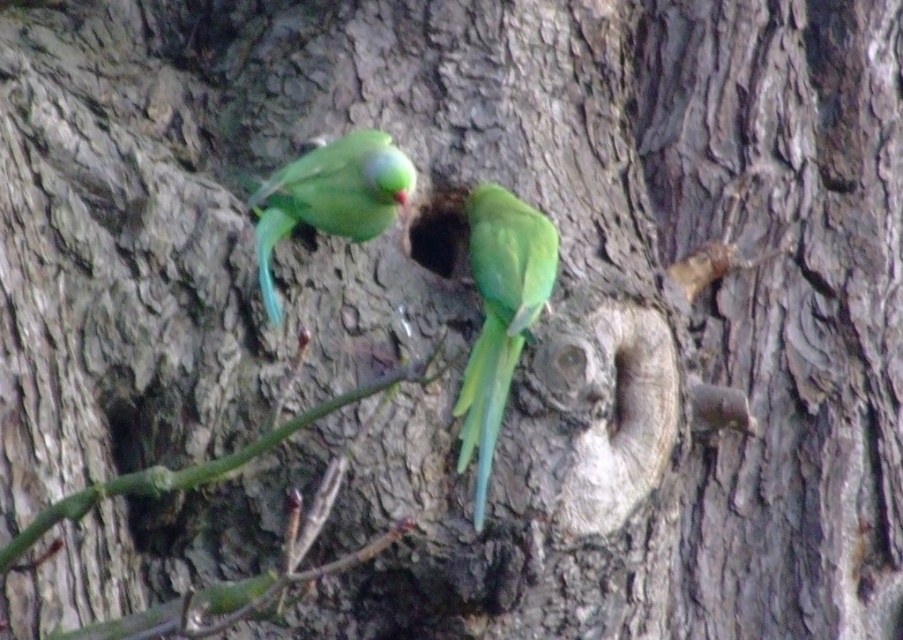
You are a birdwatcher trying to locate the green matte parrot at center. Based on the coordinates provided, can you determine if it is positioned near the center of the image?

The green matte parrot at center is located at point (500, 314), which is very close to the center coordinates of an image, so yes, it is positioned near the center of the image.